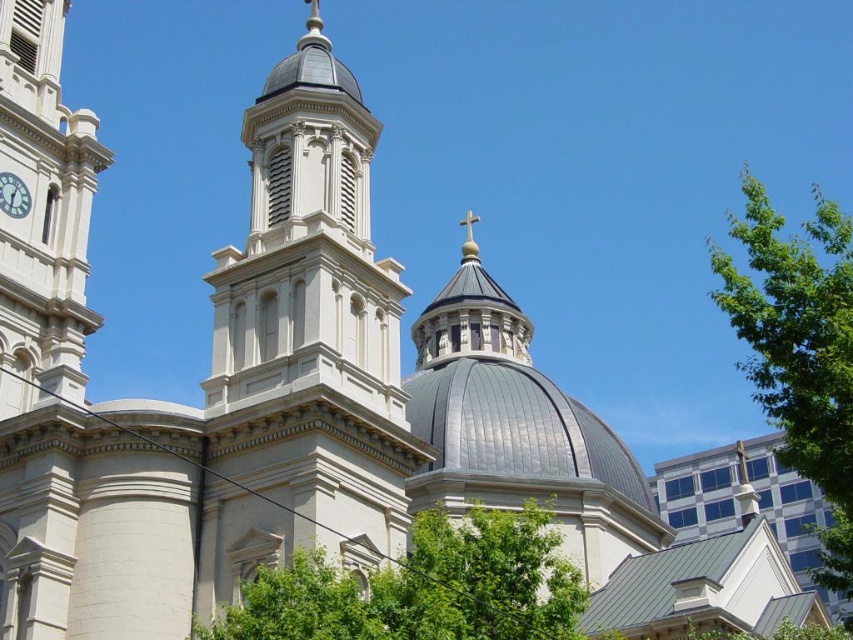
Question: From the image, what is the correct spatial relationship of green leafy tree at center in relation to green leafy tree at right?

Choices:
 (A) above
 (B) below

Answer: (B)

Question: Which of the following is the closest to the observer?

Choices:
 (A) (79, 209)
 (B) (767, 342)
 (C) (360, 625)

Answer: (B)

Question: Based on their relative distances, which object is nearer to the white stone clock tower at left?

Choices:
 (A) green leafy tree at right
 (B) smooth white tower at center

Answer: (B)

Question: Can you confirm if smooth white tower at center is positioned to the right of metallic clock face at left?

Choices:
 (A) yes
 (B) no

Answer: (A)

Question: Which point appears farthest from the camera in this image?

Choices:
 (A) (820, 198)
 (B) (267, 120)
 (C) (573, 600)

Answer: (A)

Question: Is green leafy tree at center wider than metallic clock face at left?

Choices:
 (A) no
 (B) yes

Answer: (B)